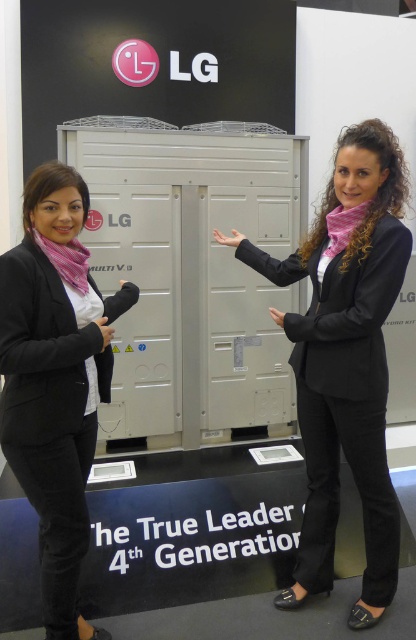
You are a technician standing 2 meters away from the LG unit. You need to reach the skinny white hand at center to adjust a control panel. Is the distance sufficient for you to comfortably reach without moving closer?

The distance between the skinny white hand at center and the viewer is 2.27 meters. Since you are 2 meters away, you are slightly closer than the measured distance, so you can comfortably reach the skinny white hand at center without needing to move closer.

You are a delivery person who needs to place a package on the metallic gray locker at center. However, there is a black leather hand at center in the way. Can you move the package past the hand to reach the locker?

The metallic gray locker at center is further to the viewer than the black leather hand at center, so you can move the package past the black leather hand at center to reach the locker.

Based on the photo, you are observing two hands in the image. The skinny white hand at center and the matte black hand at center. Which hand is taller?

The skinny white hand at center is taller than the matte black hand at center.